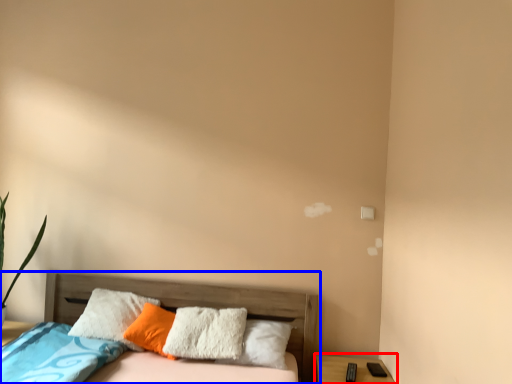
Question: Which object appears farthest to the camera in this image, nightstand (highlighted by a red box) or bed (highlighted by a blue box)?

Choices:
 (A) nightstand
 (B) bed

Answer: (A)